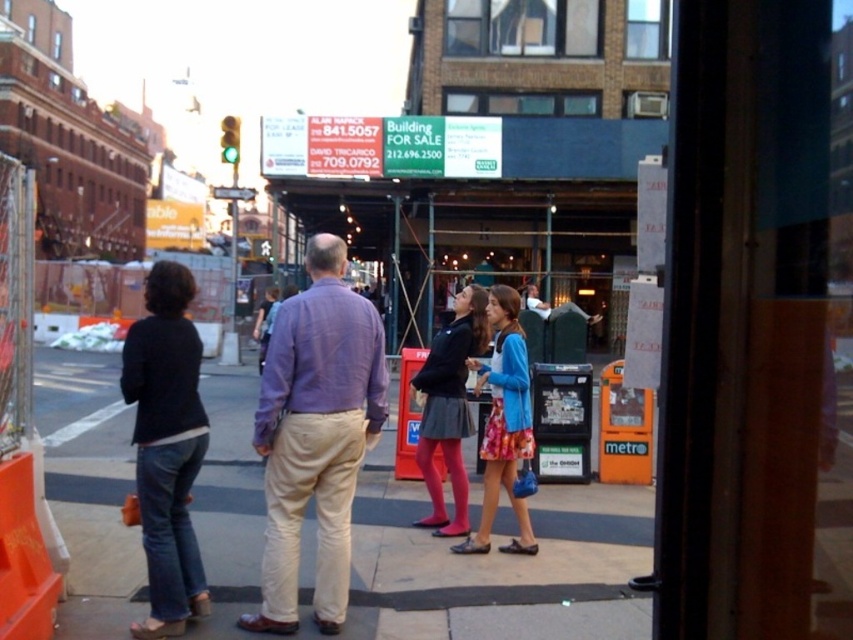
You are a fashion designer analyzing the clothing items in the scene. Which clothing item has a greater width between the purple cotton shirt at center and the matte black skirt at center?

The purple cotton shirt at center has a greater width than the matte black skirt at center according to the description.

You are standing on the smooth concrete sidewalk at center. If you want to walk to the point marked at coordinates 0.884, 0.586, which direction should you move?

You should move towards the point marked at coordinates (498, 564), which is the location of the smooth concrete sidewalk at center.